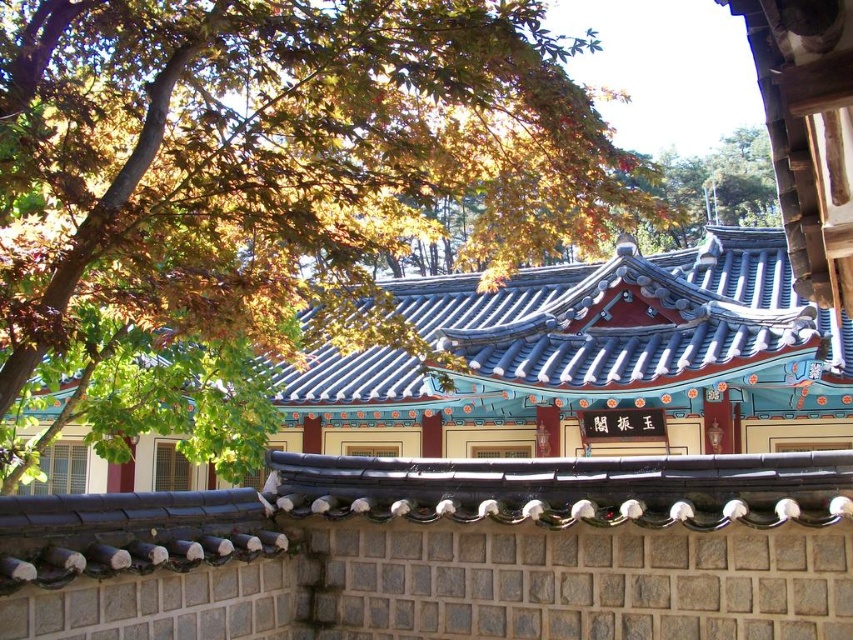
Looking at the traditional Korean building scene, where is the blue glazed tile roof at center in relation to the green leafy tree at upper left?

The blue glazed tile roof at center is to the left of the green leafy tree at upper left.

You are standing in front of a traditional Korean building. You notice a blue glazed tile roof at center and a green leafy tree at upper left. Which object is positioned closer to you?

The blue glazed tile roof at center is closer to the viewer than the green leafy tree at upper left.

Consider the image. You are standing in front of the traditional Korean building and want to take a photo. You notice two points marked on the roof. One is at point (x=367, y=611) and the other at point (x=265, y=320). Which point will appear larger in your photo?

Point (x=367, y=611) will appear larger in the photo because it is closer to the camera than point (x=265, y=320).